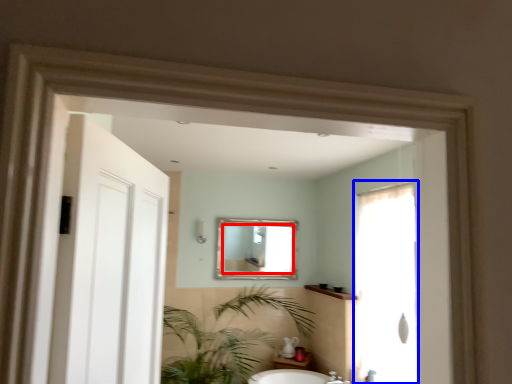
Question: Which of the following is the farthest to the observer, mirror (highlighted by a red box) or screen door (highlighted by a blue box)?

Choices:
 (A) mirror
 (B) screen door

Answer: (A)